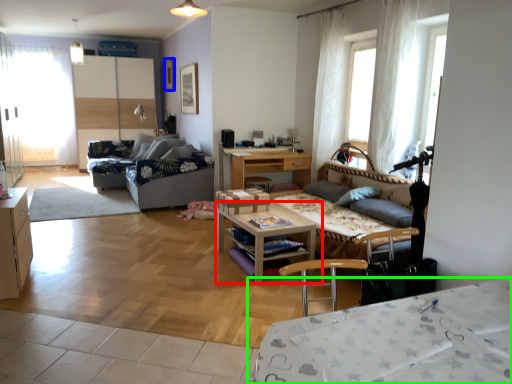
Question: Estimate the real-world distances between objects in this image. Which object is closer to table (highlighted by a red box), picture frame (highlighted by a blue box) or desk (highlighted by a green box)?

Choices:
 (A) picture frame
 (B) desk

Answer: (B)